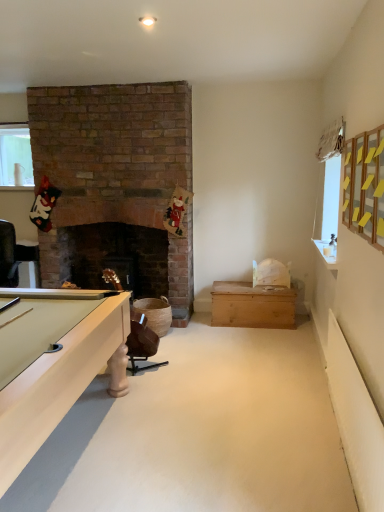
Question: Are white glossy counter top at upper right and clear glass vase at upper left beside each other?

Choices:
 (A) yes
 (B) no

Answer: (B)

Question: Is white glossy counter top at upper right facing towards clear glass vase at upper left?

Choices:
 (A) yes
 (B) no

Answer: (B)

Question: Is white glossy counter top at upper right thinner than clear glass vase at upper left?

Choices:
 (A) no
 (B) yes

Answer: (A)

Question: From the image's perspective, is white glossy counter top at upper right located beneath clear glass vase at upper left?

Choices:
 (A) no
 (B) yes

Answer: (B)

Question: Can you confirm if white glossy counter top at upper right is bigger than clear glass vase at upper left?

Choices:
 (A) no
 (B) yes

Answer: (A)

Question: Is brown leather chair at lower center in front of or behind white glossy counter top at upper right in the image?

Choices:
 (A) front
 (B) behind

Answer: (B)

Question: In terms of height, does brown leather chair at lower center look taller or shorter compared to white glossy counter top at upper right?

Choices:
 (A) tall
 (B) short

Answer: (A)

Question: Is point (129, 352) closer or farther from the camera than point (337, 266)?

Choices:
 (A) closer
 (B) farther

Answer: (B)

Question: From the image's perspective, relative to white glossy counter top at upper right, is brown leather chair at lower center above or below?

Choices:
 (A) above
 (B) below

Answer: (B)

Question: Which is correct: wooden chest at center is inside clear glass vase at upper left, or outside of it?

Choices:
 (A) inside
 (B) outside

Answer: (B)

Question: Is wooden chest at center wider or thinner than clear glass vase at upper left?

Choices:
 (A) thin
 (B) wide

Answer: (B)

Question: Relative to clear glass vase at upper left, is wooden chest at center in front or behind?

Choices:
 (A) behind
 (B) front

Answer: (B)

Question: Would you say wooden chest at center is to the left or to the right of clear glass vase at upper left in the picture?

Choices:
 (A) left
 (B) right

Answer: (B)

Question: Considering their positions, is clear glass vase at upper left located in front of or behind wooden chest at center?

Choices:
 (A) front
 (B) behind

Answer: (B)

Question: In the image, is clear glass vase at upper left on the left side or the right side of wooden chest at center?

Choices:
 (A) right
 (B) left

Answer: (B)